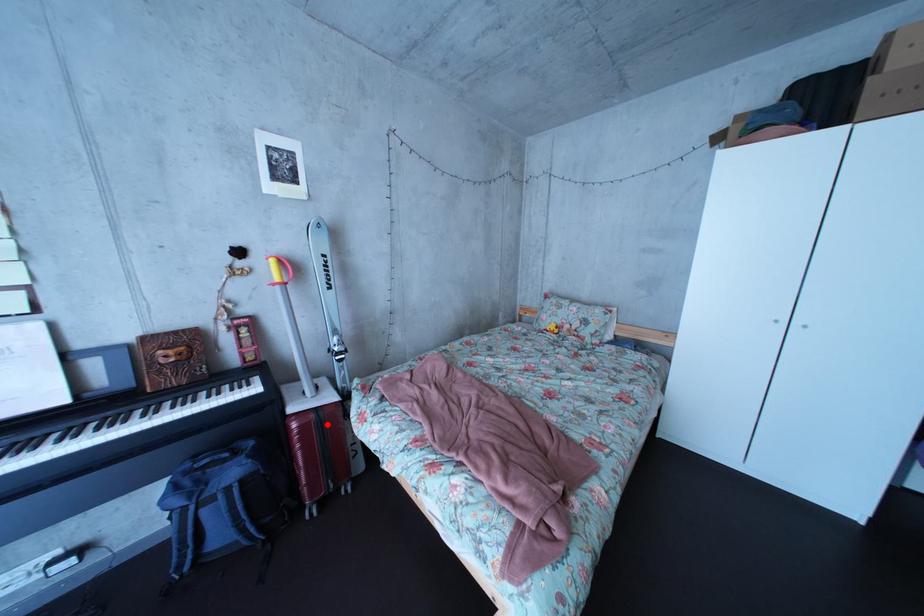
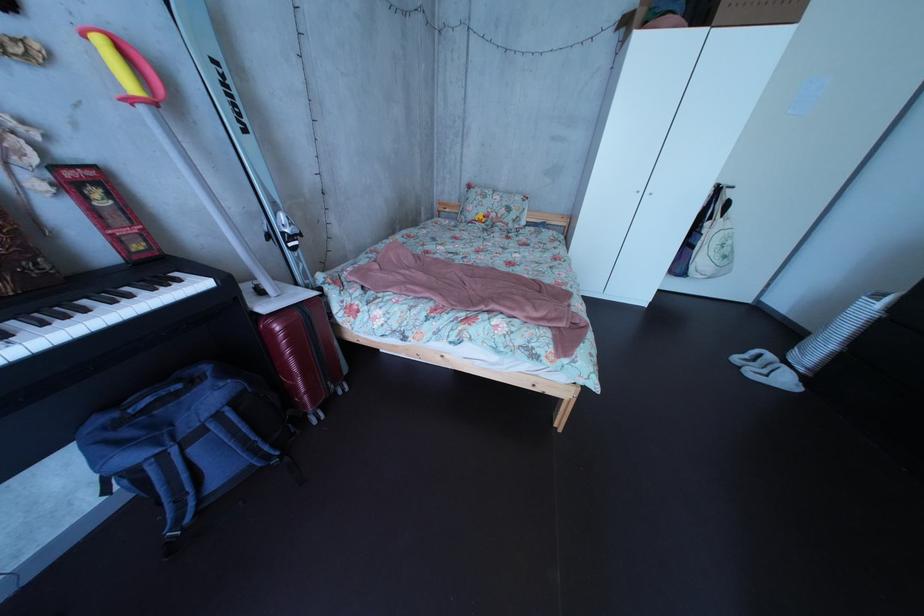
Question: I am providing you with two images of the same scene from different viewpoints. In image1, a red point is highlighted. Considering the same 3D point in image2, which of the following is correct?

Choices:
 (A) It is closer
 (B) It is farther

Answer: (A)